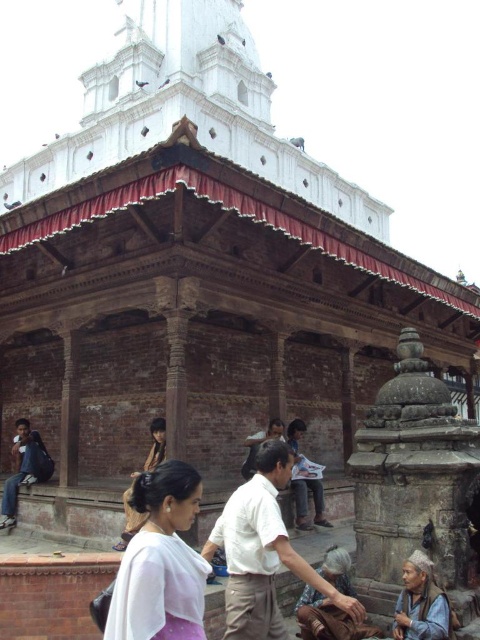
You are standing at the temple and see two points marked in the image. The first point is at coordinates point [344,595] and the second is at point [300,460]. Which point is closer to you?

Point [344,595] is in front of point [300,460], so it is closer to you.

You are a tourist at the temple and see the brown leather bag at lower center and the white paper at center. Which object is closer to the left side of the scene?

The brown leather bag at lower center is to the left of the white paper at center, so it is closer to the left side of the scene.